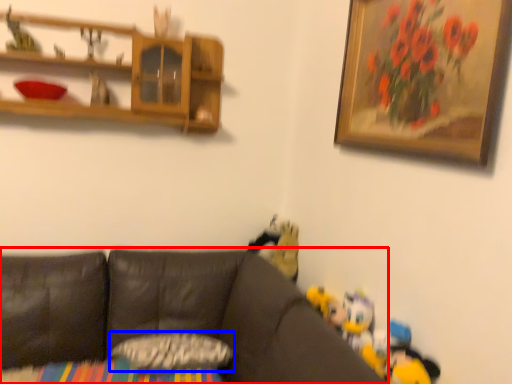
Question: Among these objects, which one is nearest to the camera, studio couch (highlighted by a red box) or pillow (highlighted by a blue box)?

Choices:
 (A) studio couch
 (B) pillow

Answer: (A)